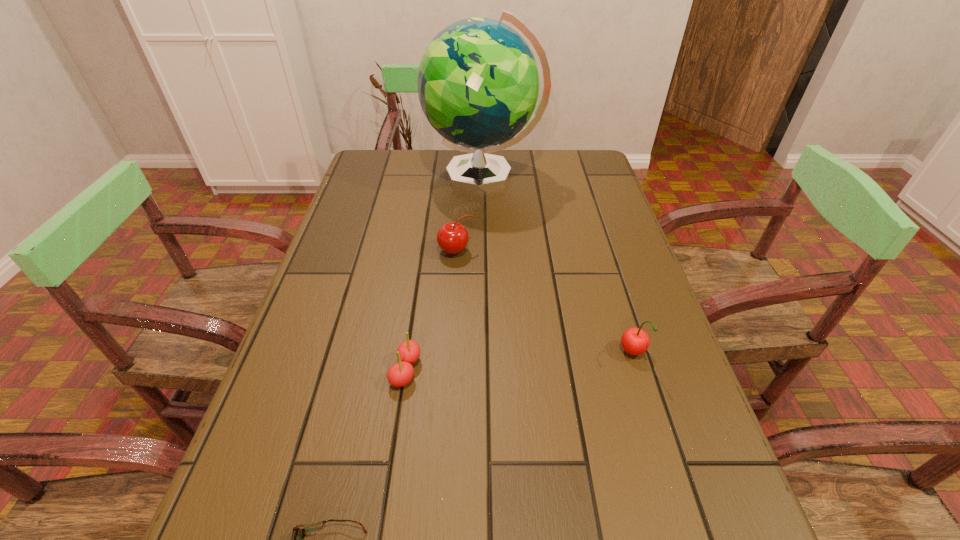
Where is `the tallest object`? This screenshot has height=540, width=960. the tallest object is located at coordinates (478, 82).

This screenshot has height=540, width=960. In order to click on globe in this screenshot , I will do pyautogui.click(x=478, y=82).

You are a GUI agent. You are given a task and a screenshot of the screen. Output one action in this format:
    pyautogui.click(x=<x>, y=<y>)
    Task: Click on the rightmost object
    This screenshot has width=960, height=540.
    Given the screenshot: What is the action you would take?
    coord(635,341)

The width and height of the screenshot is (960, 540). Identify the location of the second cherry from left to right. (x=452, y=237).

In order to click on the farthest cherry in this screenshot , I will do `click(452, 237)`.

This screenshot has width=960, height=540. Find the location of `the leftmost cherry`. the leftmost cherry is located at coordinates (400, 374).

You are a GUI agent. You are given a task and a screenshot of the screen. Output one action in this format:
    pyautogui.click(x=<x>, y=<y>)
    Task: Click on the second shortest object
    
    Given the screenshot: What is the action you would take?
    pyautogui.click(x=400, y=374)

Where is `vacant space located on the front surface of the farthest object`? vacant space located on the front surface of the farthest object is located at coordinates (382, 176).

At what (x,y) coordinates should I click in order to perform the action: click on vacant space located 0.160m on the front surface of the farthest object. Please return your answer as a coordinate pair (x, y). The image size is (960, 540). Looking at the image, I should click on 375,176.

Find the location of a particular element. vacant area located on the front surface of the farthest object is located at coordinates (360, 176).